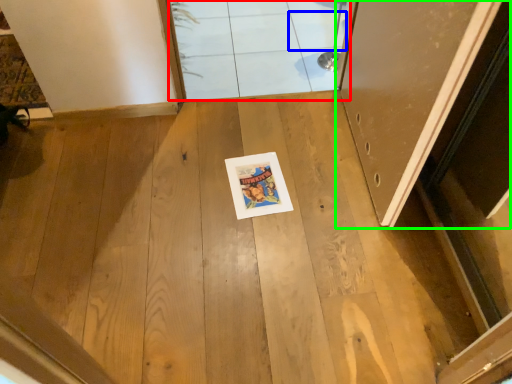
Question: Based on their relative distances, which object is nearer to window (highlighted by a red box)? Choose from tile (highlighted by a blue box) and door (highlighted by a green box).

Choices:
 (A) tile
 (B) door

Answer: (A)